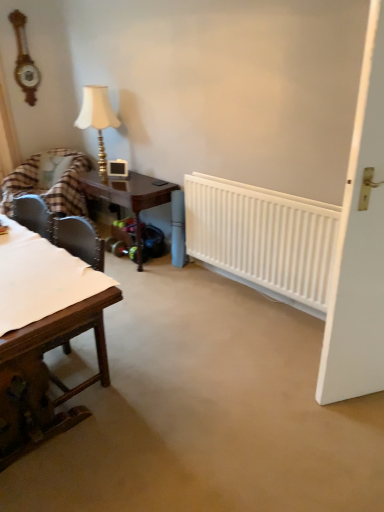
Question: In the image, is wooden clock at upper left positioned in front of or behind plaid fabric chair at left?

Choices:
 (A) behind
 (B) front

Answer: (A)

Question: From a real-world perspective, is wooden clock at upper left positioned above or below plaid fabric chair at left?

Choices:
 (A) below
 (B) above

Answer: (B)

Question: Based on their relative distances, which object is farther from the mahogany wood table at center, acting as the second table starting from the front?

Choices:
 (A) wooden clock at upper left
 (B) wooden table at left, the 1th table from the front
 (C) white matte door at right
 (D) white plastic radiator at center
 (E) plaid fabric chair at left

Answer: (C)

Question: Which of these objects is positioned closest to the white plastic radiator at center?

Choices:
 (A) wooden table at left, the 2th table when ordered from back to front
 (B) mahogany wood table at center, acting as the second table starting from the front
 (C) wooden clock at upper left
 (D) matte gold table lamp at upper left
 (E) white matte door at right

Answer: (B)